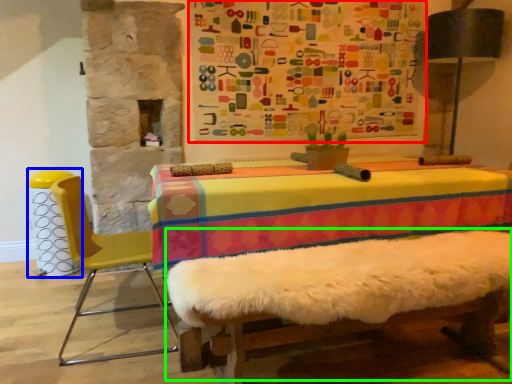
Question: Estimate the real-world distances between objects in this image. Which object is closer to bulletin board (highlighted by a red box), bar stool (highlighted by a blue box) or bed frame (highlighted by a green box)?

Choices:
 (A) bar stool
 (B) bed frame

Answer: (B)